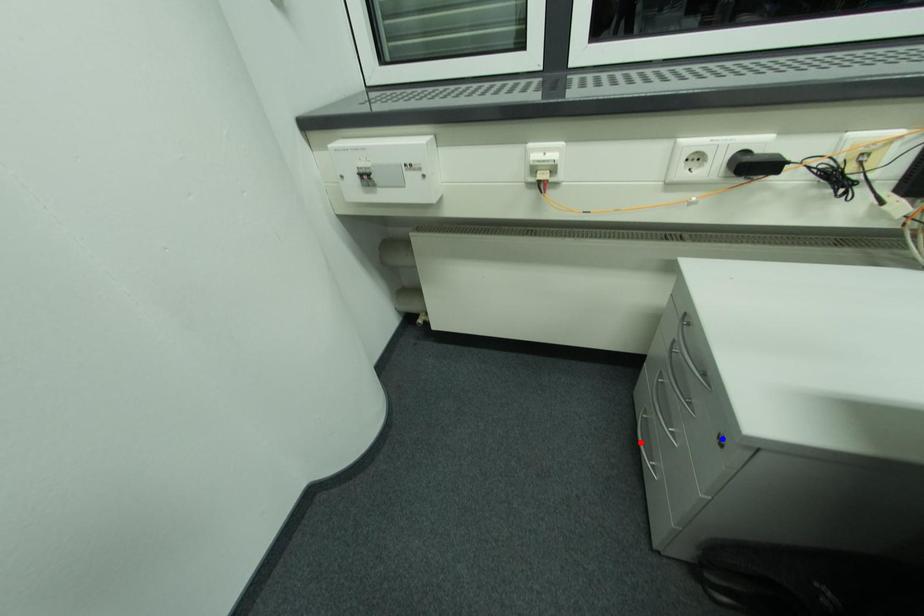
Question: Which of the two points in the image is closer to the camera?

Choices:
 (A) Blue point is closer.
 (B) Red point is closer.

Answer: (A)